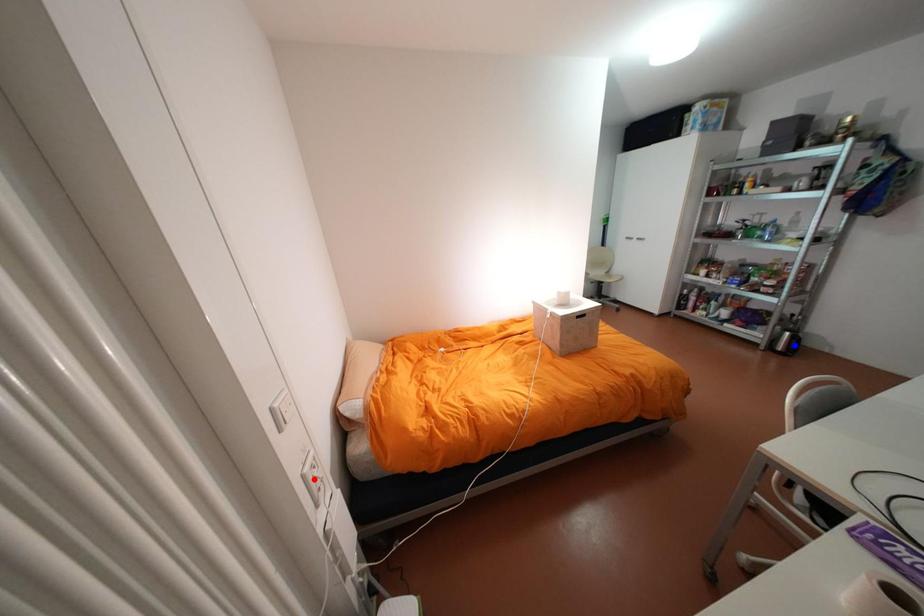
Question: Two points are marked on the image. Which point is closer to the camera?

Choices:
 (A) Blue point is closer.
 (B) Red point is closer.

Answer: (B)